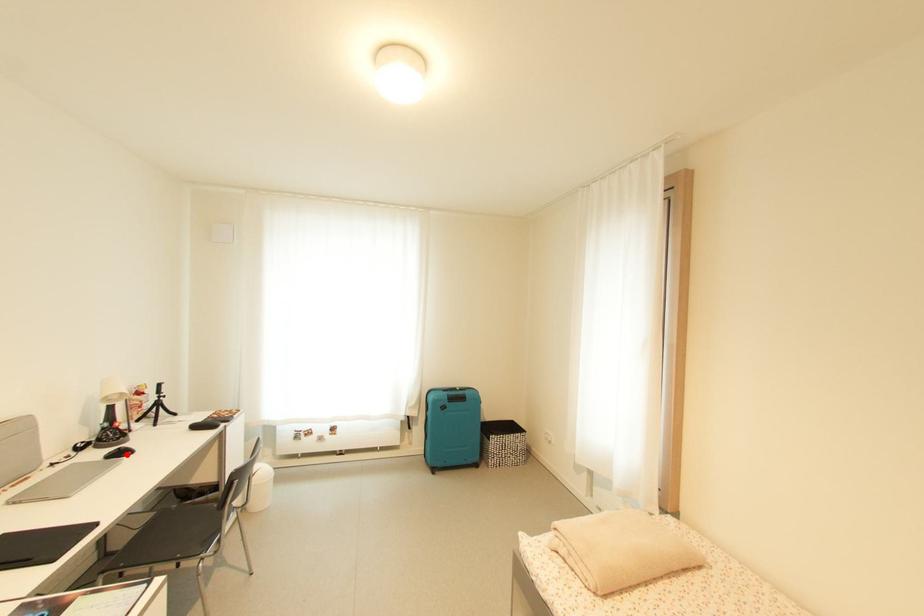
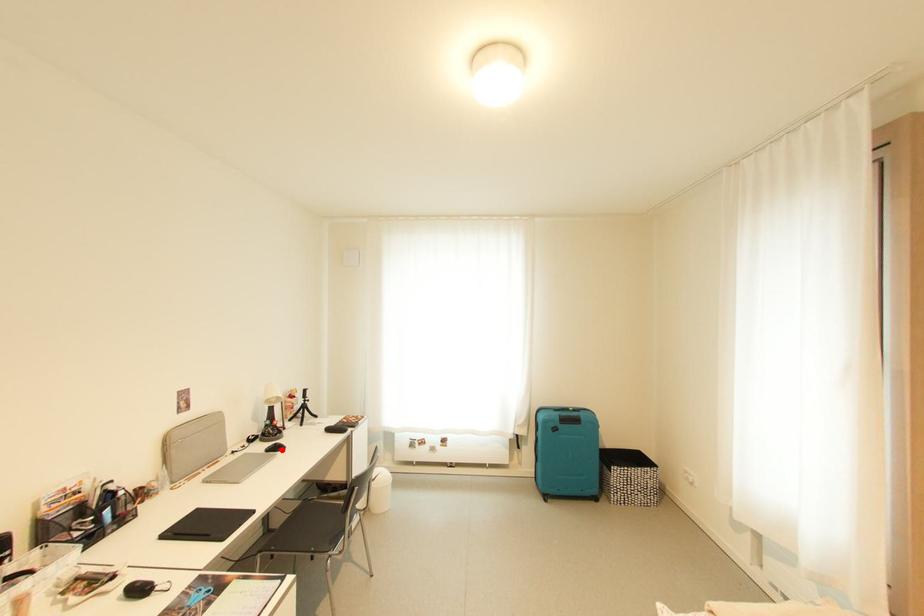
I am providing you with two images of the same scene from different viewpoints. A red point is marked on the first image and another point is marked on the second image. Does the point marked in image1 correspond to the same location as the one in image2?

Yes